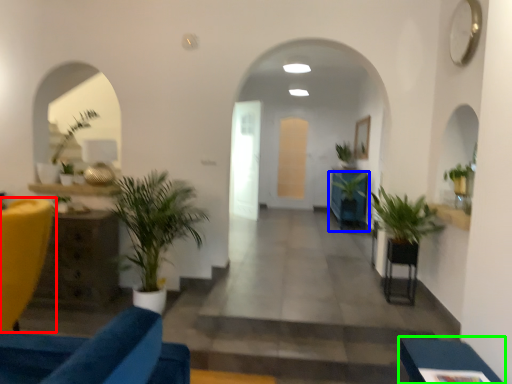
Question: Which object is positioned farthest from furniture (highlighted by a red box)? Select from houseplant (highlighted by a blue box) and furniture (highlighted by a green box).

Choices:
 (A) houseplant
 (B) furniture

Answer: (A)